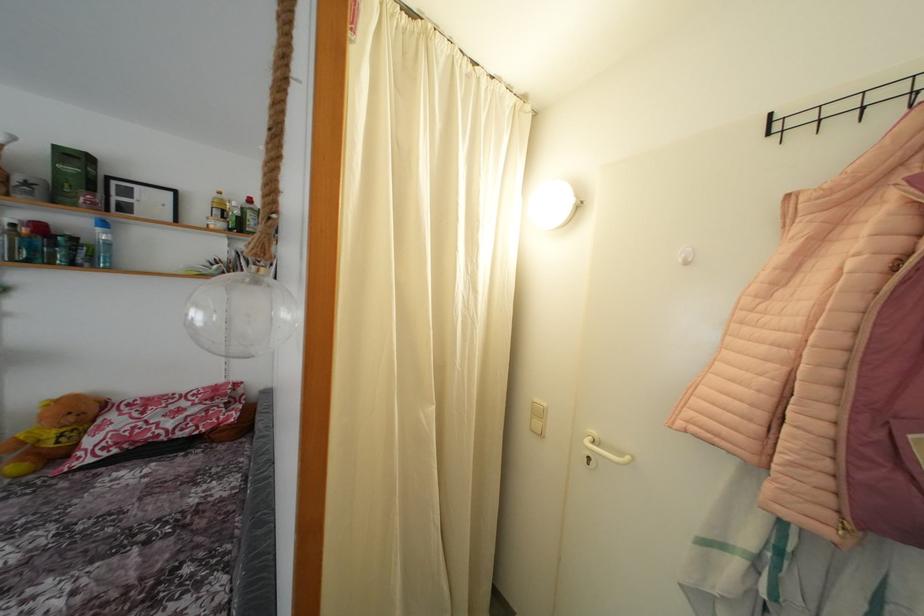
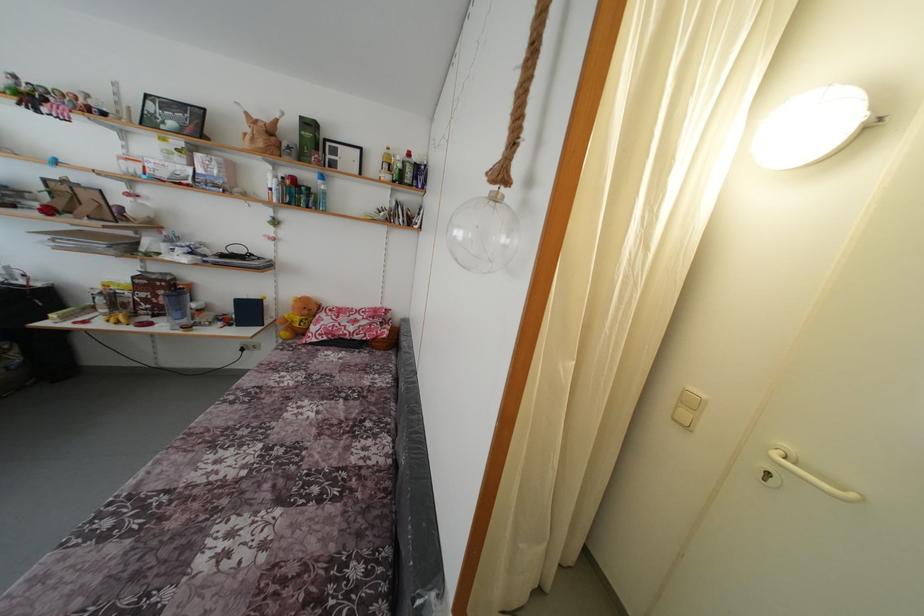
Locate, in the second image, the point that corresponds to pixel 633 464 in the first image.

(859, 501)